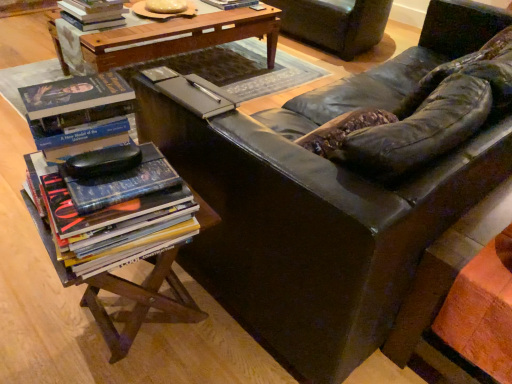
Where is `free point above matte brown book at center (from a real-world perspective)`? free point above matte brown book at center (from a real-world perspective) is located at coordinates (195, 96).